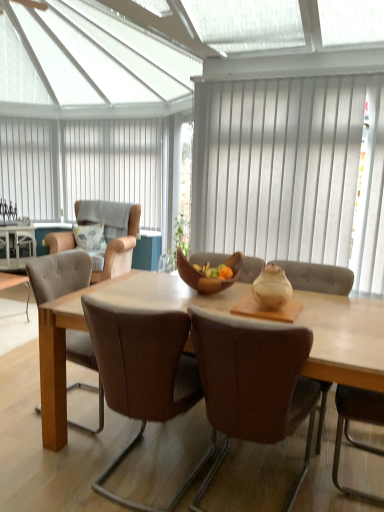
Where is `vacant point to the left of brown leather chair at center, which is the second chair from front to back`? This screenshot has height=512, width=384. vacant point to the left of brown leather chair at center, which is the second chair from front to back is located at coordinates (61, 465).